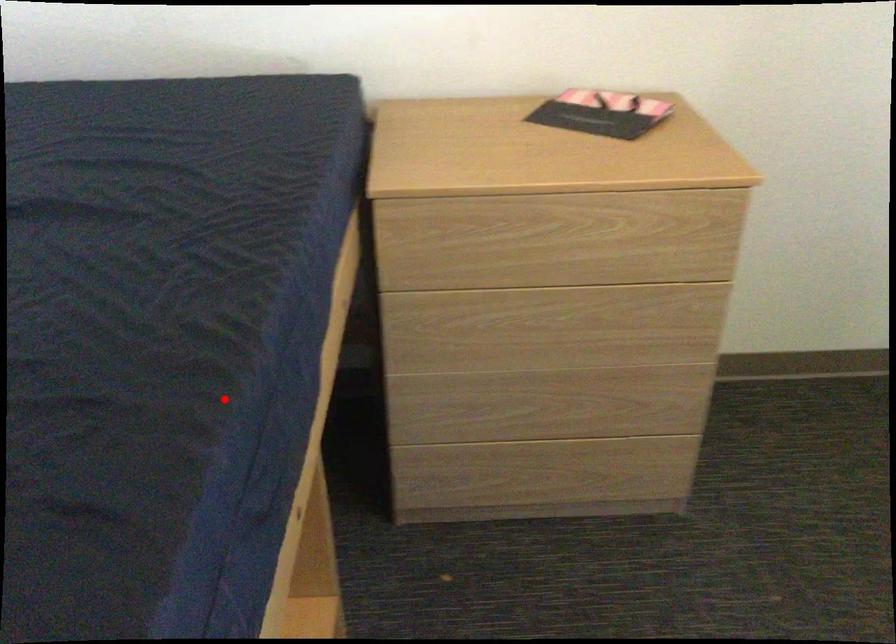
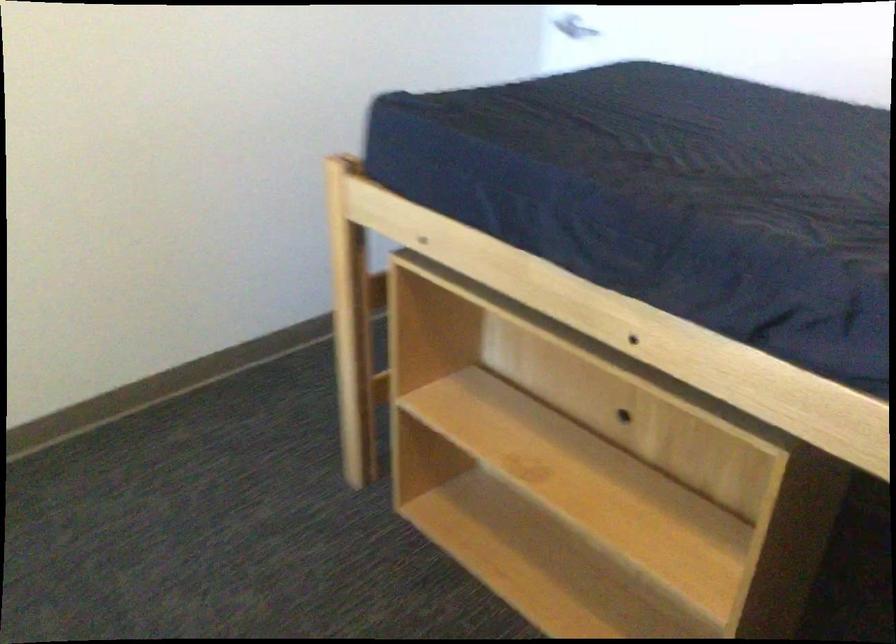
In the second image, find the point that corresponds to the highlighted location in the first image.

(651, 193)